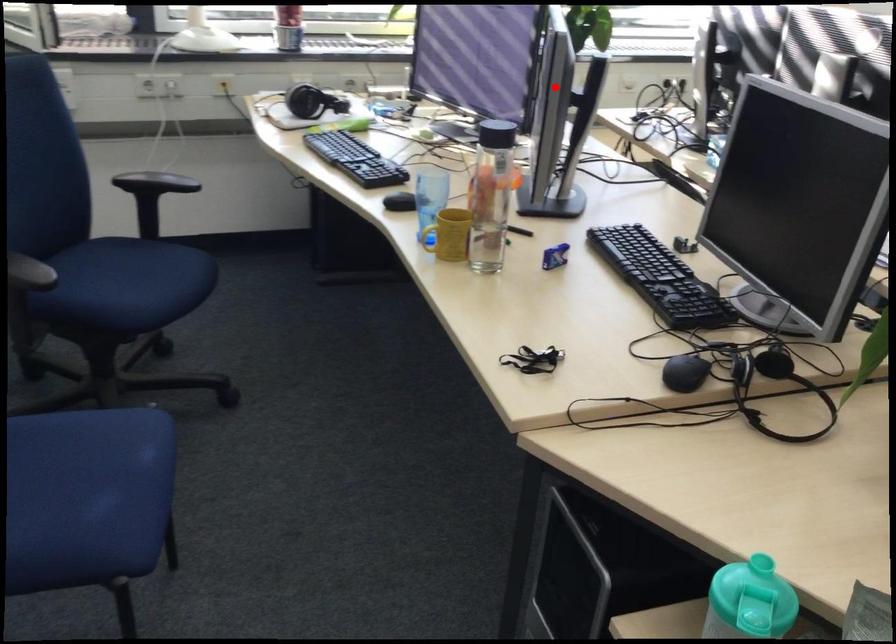
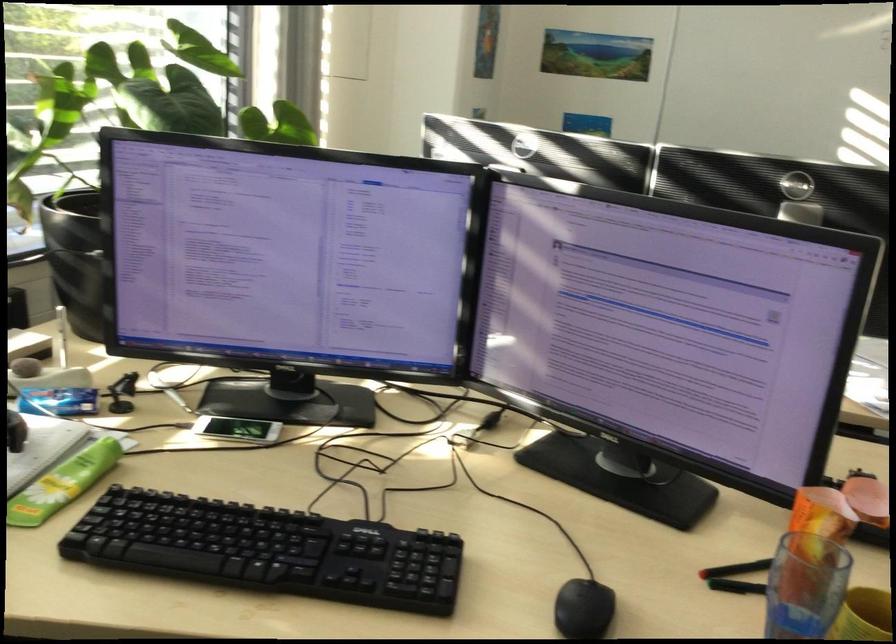
Question: A red point is marked in image1. In image2, is the corresponding 3D point closer to the camera or farther? Reply with the corresponding letter.

Choices:
 (A) The corresponding 3D point is closer.
 (B) The corresponding 3D point is farther.

Answer: (A)